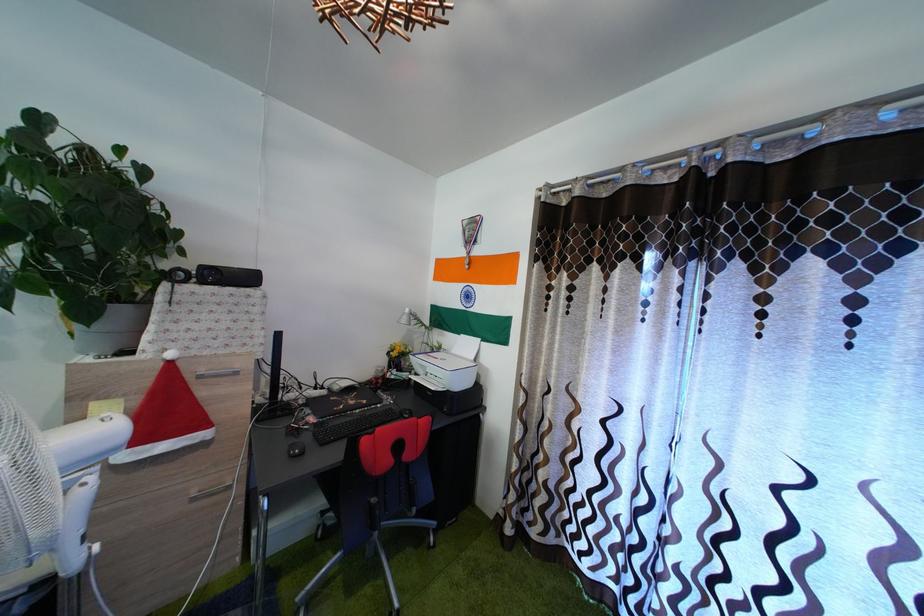
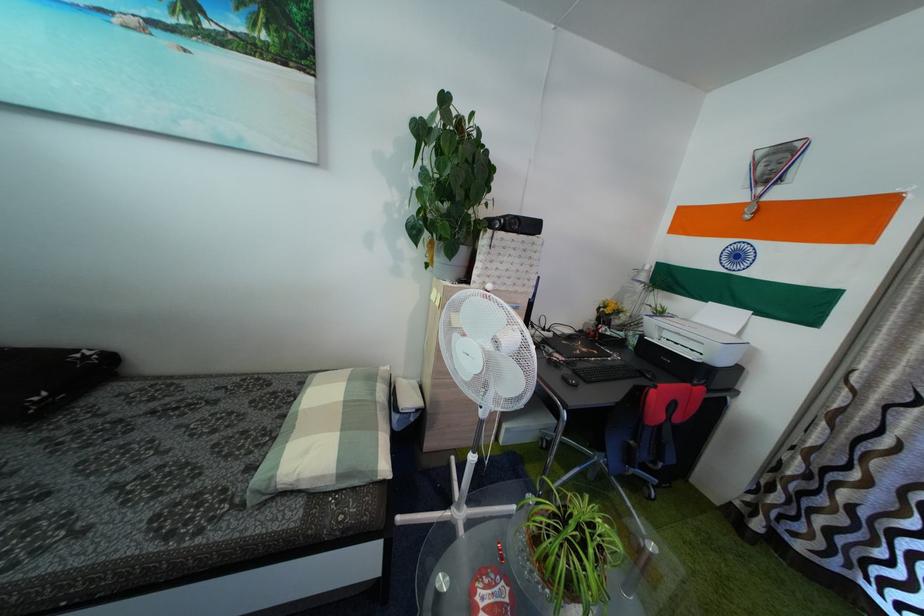
Question: The camera is either moving clockwise (left) or counter-clockwise (right) around the object. The first image is from the beginning of the video and the second image is from the end. Is the camera moving left or right when shooting the video?

Choices:
 (A) Left
 (B) Right

Answer: (B)